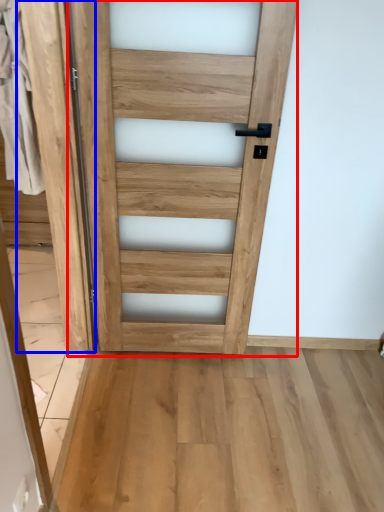
Question: Which point is closer to the camera, door (highlighted by a red box) or barn door (highlighted by a blue box)?

Choices:
 (A) door
 (B) barn door

Answer: (B)